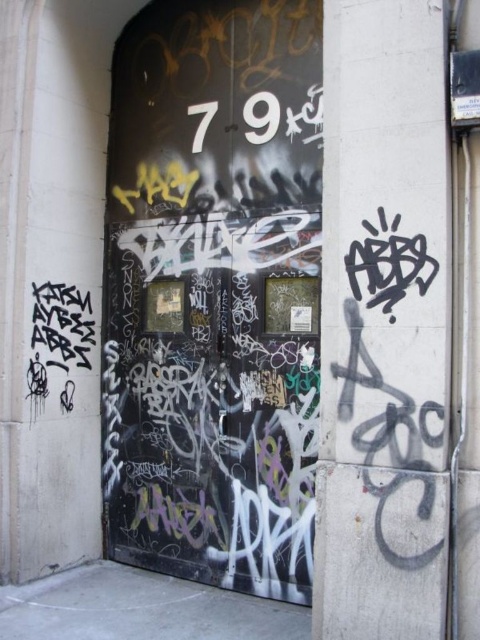
Question: Which of the following is the closest to the observer?

Choices:
 (A) (377, 588)
 (B) (204, 472)

Answer: (A)

Question: Which point appears farthest from the camera in this image?

Choices:
 (A) (307, 588)
 (B) (377, 168)

Answer: (A)

Question: Observing the image, what is the correct spatial positioning of black textured door at center in reference to grungy concrete pillar at center?

Choices:
 (A) left
 (B) right

Answer: (A)

Question: Is black textured door at center thinner than grungy concrete pillar at center?

Choices:
 (A) yes
 (B) no

Answer: (B)

Question: Does black textured door at center lie in front of grungy concrete pillar at center?

Choices:
 (A) yes
 (B) no

Answer: (B)